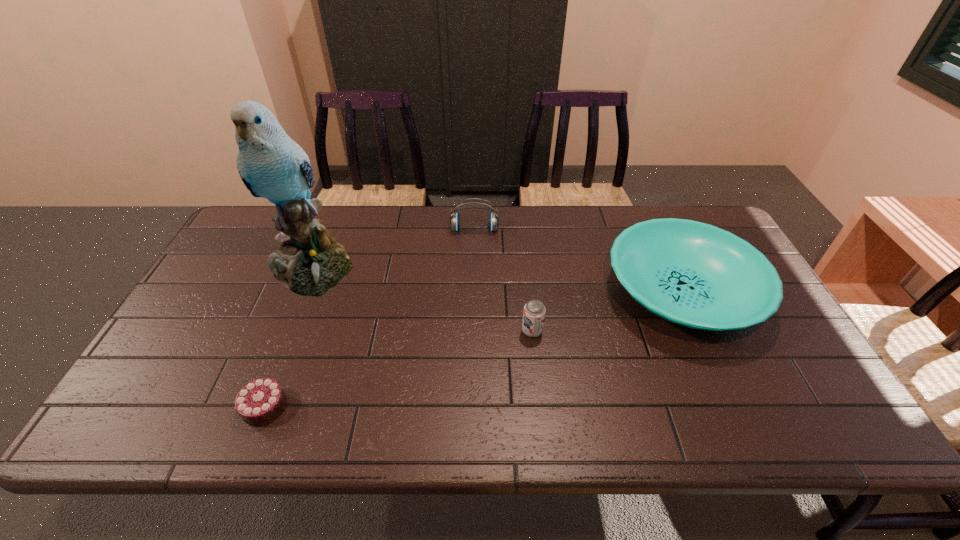
At what (x,y) coordinates should I click in order to perform the action: click on parakeet. Please return your answer as a coordinate pair (x, y). Looking at the image, I should click on (310, 262).

What are the coordinates of `the third object from right to left` in the screenshot? It's located at (454, 220).

I want to click on headset, so click(x=454, y=220).

Where is `the rightmost object`? the rightmost object is located at coordinates (693, 274).

The width and height of the screenshot is (960, 540). In order to click on the fourth object from left to right in this screenshot , I will do `click(534, 311)`.

This screenshot has width=960, height=540. Find the location of `the shortest object`. the shortest object is located at coordinates (261, 401).

The height and width of the screenshot is (540, 960). Find the location of `chocolate cake`. chocolate cake is located at coordinates (261, 401).

Where is `free location located on the face of the tallest object`? This screenshot has height=540, width=960. free location located on the face of the tallest object is located at coordinates (262, 391).

Find the location of `vacant region located on the ear cups of the third object from right to left`. vacant region located on the ear cups of the third object from right to left is located at coordinates (473, 302).

This screenshot has width=960, height=540. Identify the location of free point located on the back of the rightmost object. (655, 233).